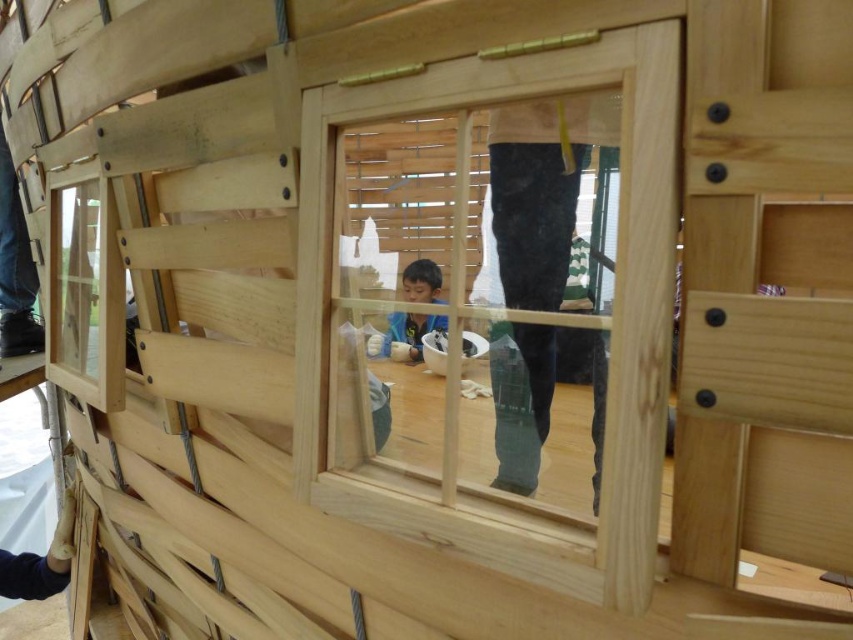
Based on the photo, you are standing in front of the wooden playhouse and notice two points marked on its structure. Point A is at coordinates point (563, 272) and Point B is at point (421, 332). Which point would appear closer to you when looking at the playhouse?

Point A at point (563, 272) is closer to the camera than point (421, 332), so it would appear closer to you when looking at the playhouse.

You are standing outside the playhouse and want to see the child inside. Which object at point (541, 189) can you look through to see the child?

The clear glass window at center located at point (541, 189) can be looked through to see the child inside the playhouse.